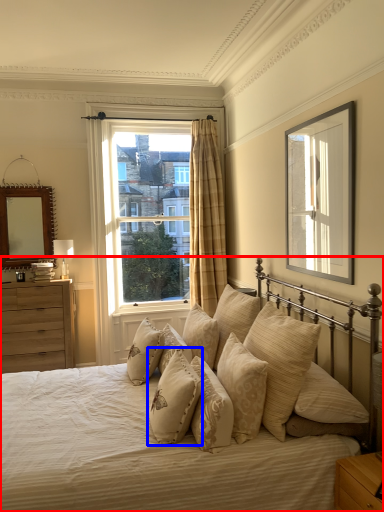
Question: Among these objects, which one is farthest to the camera, bed (highlighted by a red box) or pillow (highlighted by a blue box)?

Choices:
 (A) bed
 (B) pillow

Answer: (B)